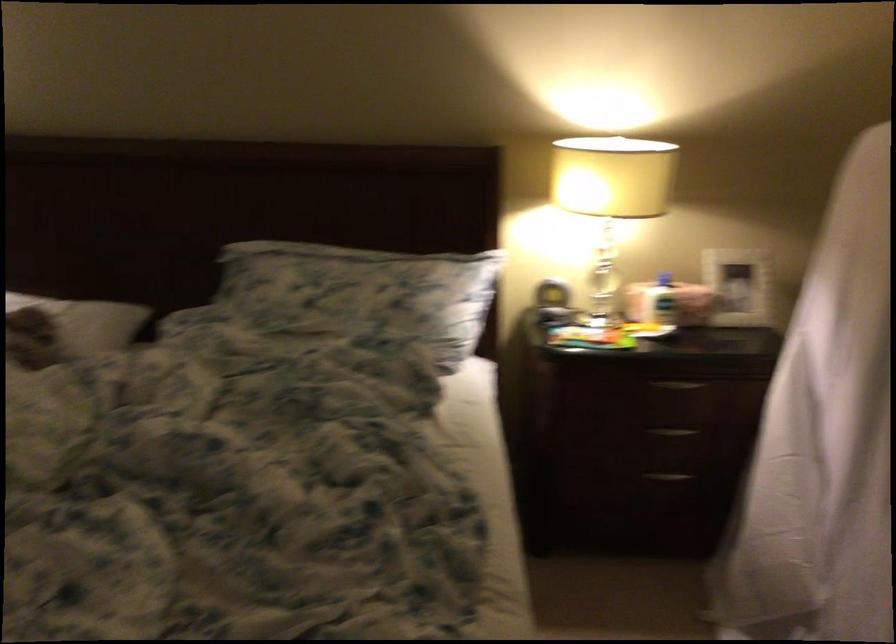
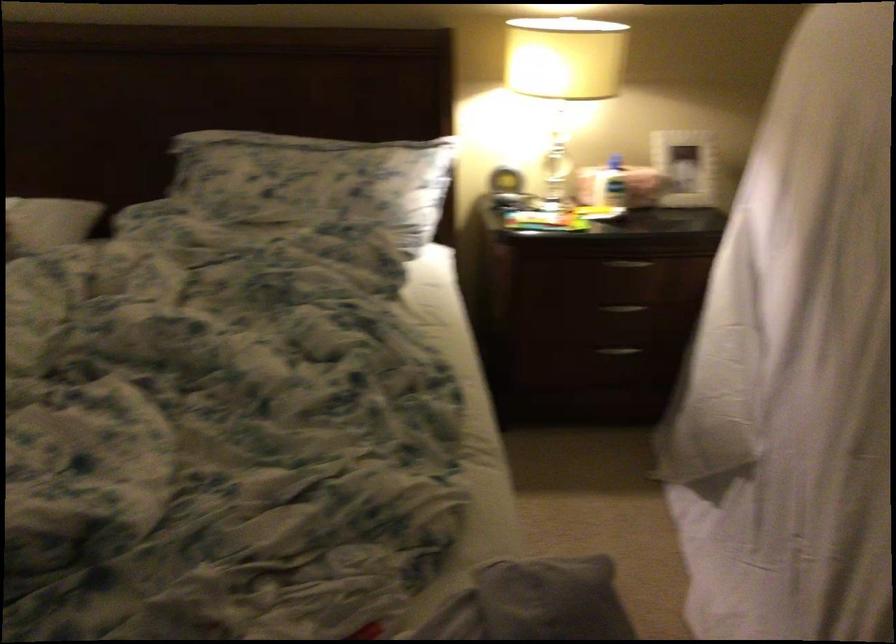
Question: The images are taken continuously from a first-person perspective. In which direction is your viewpoint rotating?

Choices:
 (A) Left
 (B) Right
 (C) Up
 (D) Down

Answer: (D)